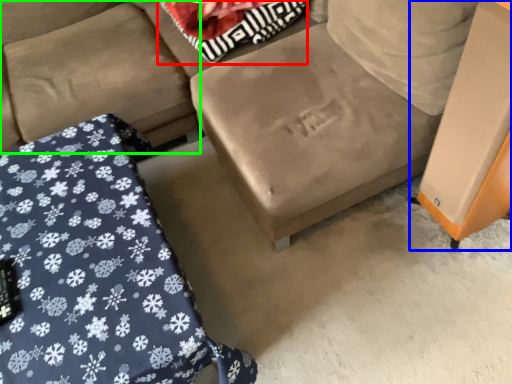
Question: Considering the real-world distances, which object is farthest from pillow (highlighted by a red box)? table (highlighted by a blue box) or couch (highlighted by a green box)?

Choices:
 (A) table
 (B) couch

Answer: (A)